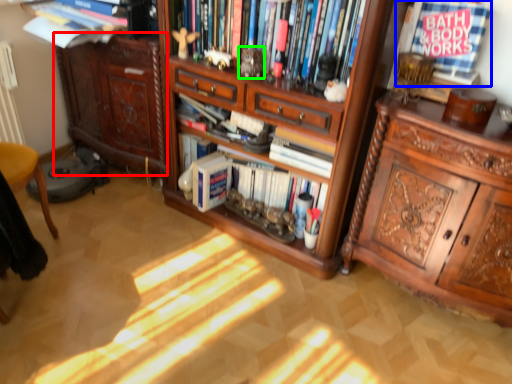
Question: Which object is the closest to the cabinetry (highlighted by a red box)? Choose among these: book (highlighted by a blue box) or toy (highlighted by a green box).

Choices:
 (A) book
 (B) toy

Answer: (B)